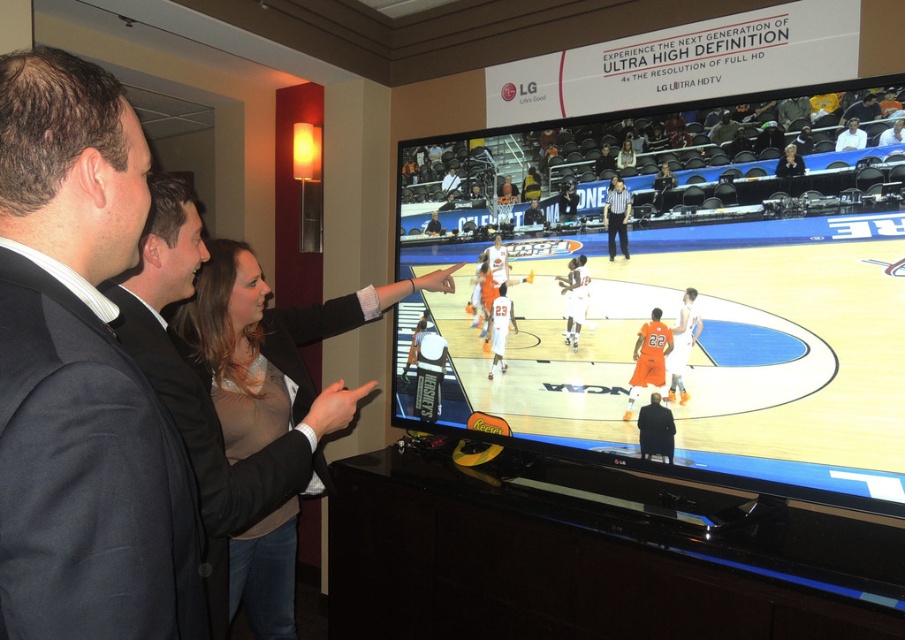
Question: Is matte black tv at center bigger than black suit at left?

Choices:
 (A) no
 (B) yes

Answer: (B)

Question: Can you confirm if dark gray suit at upper left is thinner than black suit at left?

Choices:
 (A) no
 (B) yes

Answer: (B)

Question: Which object appears closest to the camera in this image?

Choices:
 (A) matte black blazer at center
 (B) dark gray suit at upper left

Answer: (B)

Question: Which of the following is the farthest from the observer?

Choices:
 (A) (13, 458)
 (B) (610, 259)
 (C) (181, 266)

Answer: (B)

Question: Which of the following is the closest to the observer?

Choices:
 (A) black fabric jacket at center
 (B) matte black tv at center
 (C) orange jersey at center
 (D) smooth beige blouse at center

Answer: (B)

Question: Does matte black blazer at center appear on the left side of smooth beige blouse at center?

Choices:
 (A) no
 (B) yes

Answer: (B)